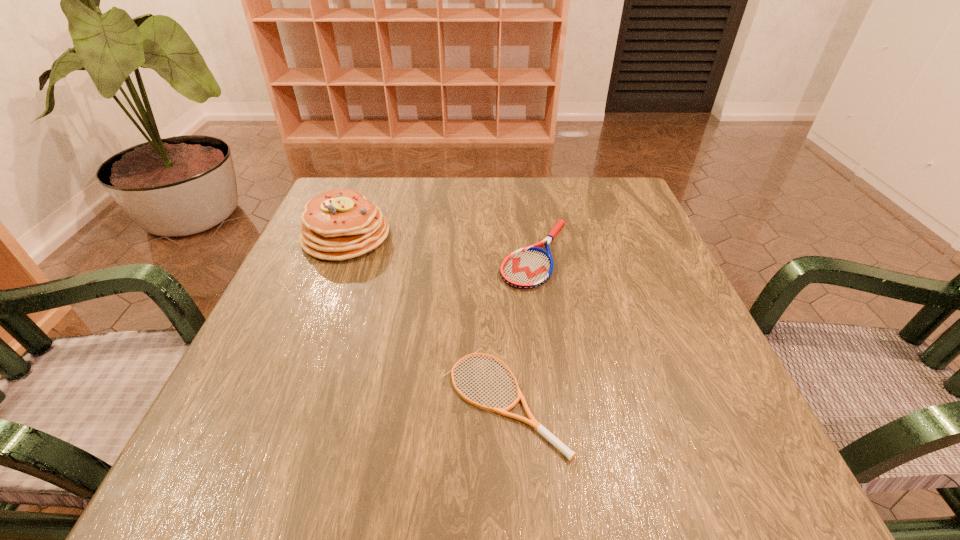
You are a GUI agent. You are given a task and a screenshot of the screen. Output one action in this format:
    pyautogui.click(x=<x>, y=<y>)
    Task: Click on the pancake
    The width and height of the screenshot is (960, 540).
    Given the screenshot: What is the action you would take?
    pyautogui.click(x=337, y=225)

I want to click on the tallest object, so click(337, 225).

Locate an element on the screen. The image size is (960, 540). the second shortest object is located at coordinates (530, 267).

Locate an element on the screen. Image resolution: width=960 pixels, height=540 pixels. the taller tennis racket is located at coordinates (530, 267).

At what (x,y) coordinates should I click in order to perform the action: click on the shortest object. Please return your answer as a coordinate pair (x, y). Looking at the image, I should click on [538, 427].

Find the location of `the nearer tennis racket`. the nearer tennis racket is located at coordinates (538, 427).

The image size is (960, 540). Identify the location of vacant space situated 0.080m on the right of the leftmost object. (424, 237).

I want to click on free space located 0.130m on the front of the farther tennis racket, so click(x=549, y=341).

Find the location of a particular element. Image resolution: width=960 pixels, height=540 pixels. free space located 0.120m on the right of the nearer tennis racket is located at coordinates (643, 400).

You are a GUI agent. You are given a task and a screenshot of the screen. Output one action in this format:
    pyautogui.click(x=<x>, y=<y>)
    Task: Click on the pancake that is at the far edge
    
    Given the screenshot: What is the action you would take?
    pyautogui.click(x=337, y=225)